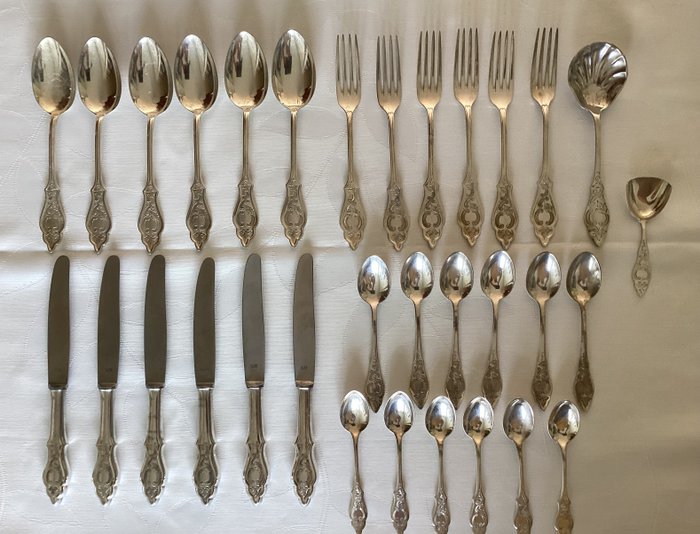
I want to click on fork, so click(x=344, y=95), click(x=393, y=101), click(x=427, y=100), click(x=468, y=95), click(x=505, y=95), click(x=545, y=95).